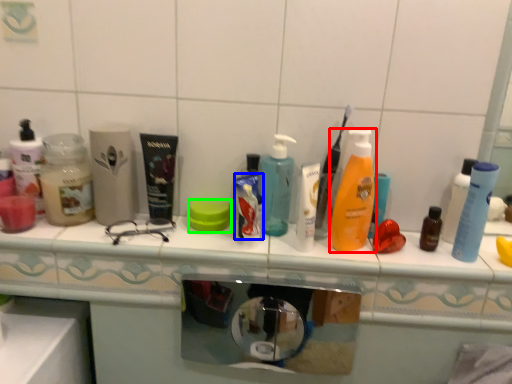
Question: Based on their relative distances, which object is farther from bottle (highlighted by a red box)? Choose from toothpaste (highlighted by a blue box) and soap (highlighted by a green box).

Choices:
 (A) toothpaste
 (B) soap

Answer: (B)